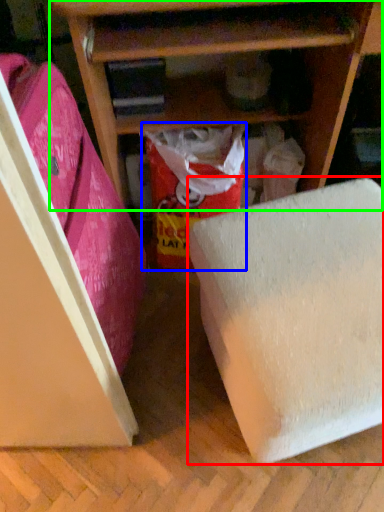
Question: Which object is the farthest from furniture (highlighted by a red box)? Choose among these: wrapping paper (highlighted by a blue box) or shelf (highlighted by a green box).

Choices:
 (A) wrapping paper
 (B) shelf

Answer: (B)